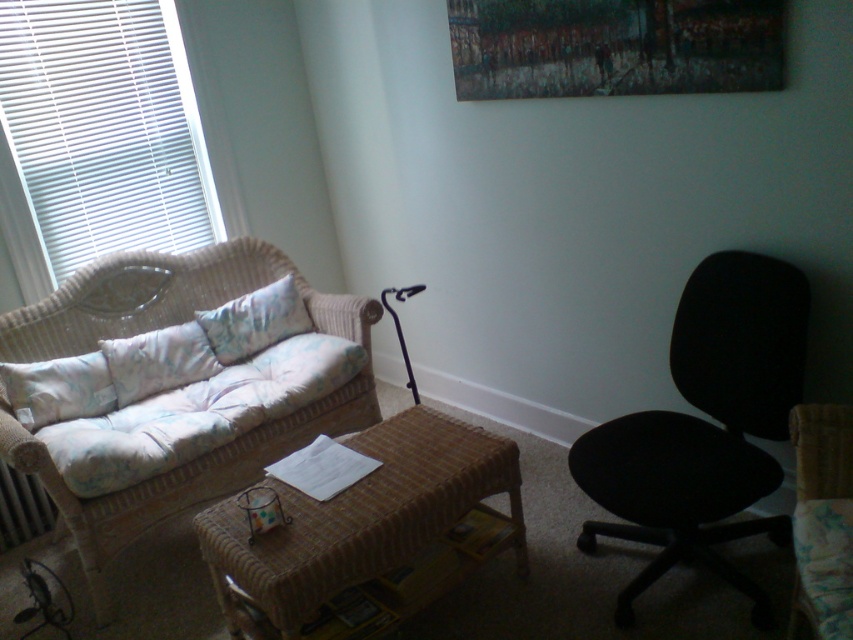
Does point (244, 547) come in front of point (811, 577)?

No, (244, 547) is further to viewer.

Between woven brown table at center and black fabric swivel chair at right, which one appears on the right side from the viewer's perspective?

From the viewer's perspective, black fabric swivel chair at right appears more on the right side.

Does point (281, 522) come in front of point (837, 417)?

No, it is behind (837, 417).

Locate an element on the screen. Image resolution: width=853 pixels, height=640 pixels. woven brown table at center is located at coordinates (364, 532).

Is white blinds at left wider than fluffy white pillow at center?

Correct, the width of white blinds at left exceeds that of fluffy white pillow at center.

Is point (16, 65) closer to camera compared to point (186, 368)?

Yes, point (16, 65) is in front of point (186, 368).

Locate an element on the screen. The image size is (853, 640). white blinds at left is located at coordinates (97, 136).

Consider the image. Does woven wicker couch at left appear on the right side of woven brown table at center?

Incorrect, woven wicker couch at left is not on the right side of woven brown table at center.

Does woven wicker couch at left have a larger size compared to woven brown table at center?

Yes, woven wicker couch at left is bigger than woven brown table at center.

Between point (306, 420) and point (480, 497), which one is positioned in front?

Point (480, 497) is more forward.

Where is `woven wicker couch at left`? woven wicker couch at left is located at coordinates (173, 385).